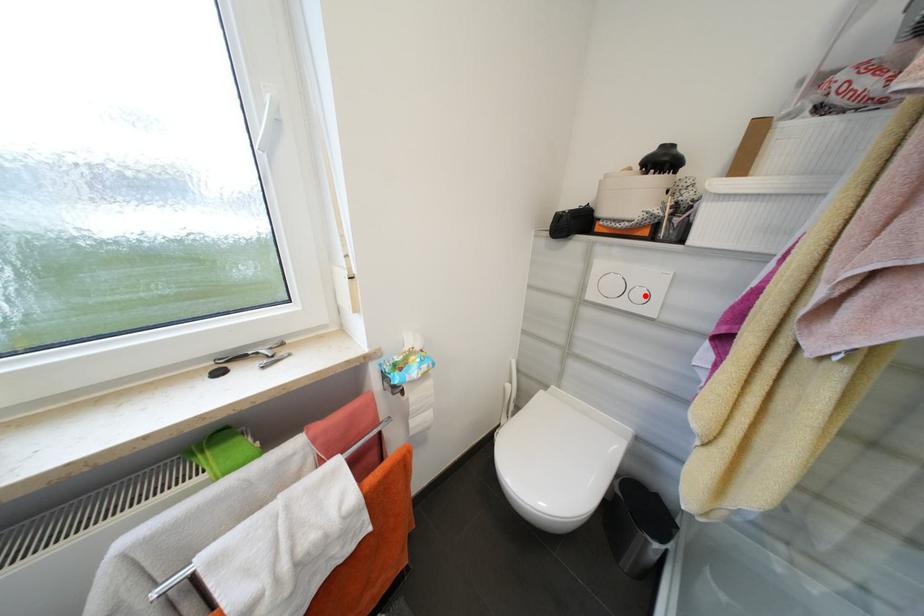
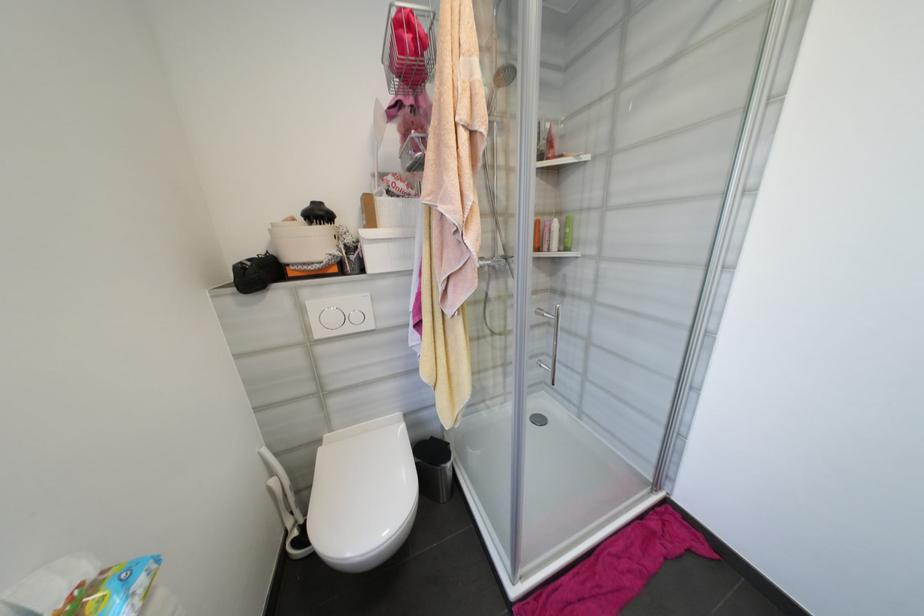
Locate, in the second image, the point that corresponds to the highlighted location in the first image.

(361, 318)